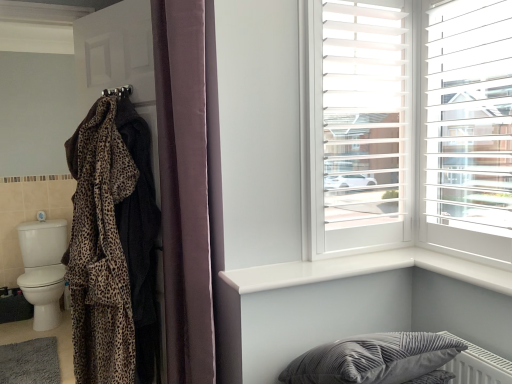
Question: Does velvet gray pillow at lower right appear on the right side of white plastic blinds at upper right?

Choices:
 (A) no
 (B) yes

Answer: (A)

Question: Considering the relative sizes of velvet gray pillow at lower right and white plastic blinds at upper right in the image provided, is velvet gray pillow at lower right shorter than white plastic blinds at upper right?

Choices:
 (A) yes
 (B) no

Answer: (A)

Question: Considering the relative sizes of velvet gray pillow at lower right and white plastic blinds at upper right in the image provided, is velvet gray pillow at lower right bigger than white plastic blinds at upper right?

Choices:
 (A) no
 (B) yes

Answer: (B)

Question: Is velvet gray pillow at lower right not near white plastic blinds at upper right?

Choices:
 (A) yes
 (B) no

Answer: (B)

Question: Considering the relative sizes of velvet gray pillow at lower right and white plastic blinds at upper right in the image provided, is velvet gray pillow at lower right thinner than white plastic blinds at upper right?

Choices:
 (A) no
 (B) yes

Answer: (A)

Question: Is velvet gray pillow at lower right facing away from white plastic blinds at upper right?

Choices:
 (A) no
 (B) yes

Answer: (A)

Question: Could you tell me if leopard print fabric robe at left is facing velvet curtain at center?

Choices:
 (A) no
 (B) yes

Answer: (A)

Question: From a real-world perspective, does leopard print fabric robe at left sit lower than velvet curtain at center?

Choices:
 (A) no
 (B) yes

Answer: (B)

Question: From the image's perspective, is leopard print fabric robe at left on top of velvet curtain at center?

Choices:
 (A) yes
 (B) no

Answer: (B)

Question: Does leopard print fabric robe at left come in front of velvet curtain at center?

Choices:
 (A) no
 (B) yes

Answer: (A)

Question: Is leopard print fabric robe at left thinner than velvet curtain at center?

Choices:
 (A) no
 (B) yes

Answer: (B)

Question: Is leopard print fabric robe at left positioned behind velvet curtain at center?

Choices:
 (A) yes
 (B) no

Answer: (A)

Question: Is leopard print fabric at left wider than velvet gray pillow at lower right?

Choices:
 (A) yes
 (B) no

Answer: (B)